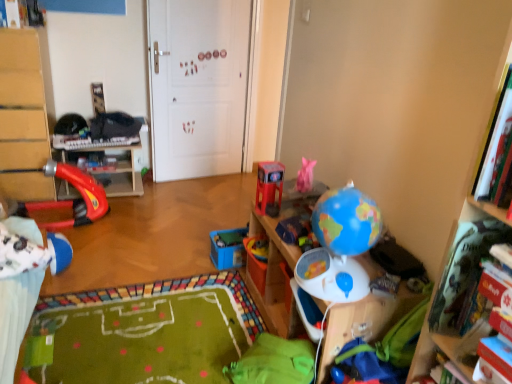
Question: Is shiny red toy car at center, the fourth toy from the left, spatially inside rubberized red slide at left, or outside of it?

Choices:
 (A) outside
 (B) inside

Answer: (A)

Question: From a real-world perspective, is shiny red toy car at center, the fourth toy from the left, positioned above or below rubberized red slide at left?

Choices:
 (A) above
 (B) below

Answer: (A)

Question: Estimate the real-world distances between objects in this image. Which object is closer to the rubberized red slide at left, arranged as the first toy when viewed from the left?

Choices:
 (A) blue matte globe at right, acting as the 2th toy starting from the right
 (B) rubberized red slide at left
 (C) white matte door at center
 (D) brown wooden shelf at left
 (E) green fabric bean bag at lower center

Answer: (B)

Question: Estimate the real-world distances between objects in this image. Which object is farther from the rubberized red slide at left?

Choices:
 (A) shiny red toy car at center, the fourth toy from the left
 (B) brown wooden shelf at left
 (C) green fabric bean bag at lower center
 (D) rubberized red slide at left, arranged as the first toy when viewed from the left
 (E) blue matte globe at right, marked as the 6th toy in a left-to-right arrangement

Answer: (E)